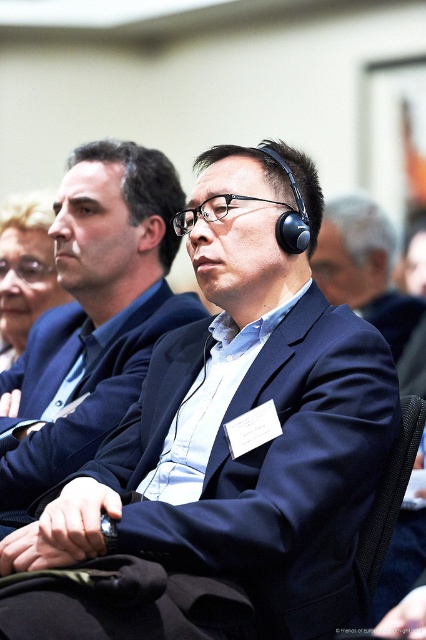
Which of these two, matte black headphones at center or black fabric chair at lower right, stands taller?

matte black headphones at center

This screenshot has height=640, width=426. Find the location of `matte black headphones at center`. matte black headphones at center is located at coordinates (363, 268).

Does matte black suit at center have a lesser height compared to matte black headphones at center?

No, matte black suit at center is not shorter than matte black headphones at center.

Between matte black suit at center and matte black headphones at center, which one is positioned higher?

matte black headphones at center is higher up.

Does point (169, 305) lie behind point (350, 291)?

No, it is in front of (350, 291).

Image resolution: width=426 pixels, height=640 pixels. Find the location of `matte black suit at center`. matte black suit at center is located at coordinates (94, 316).

Between matte black headphones at center and matte black suit at left, which one is positioned lower?

matte black suit at left is lower down.

Does matte black headphones at center have a greater height compared to matte black suit at left?

Indeed, matte black headphones at center has a greater height compared to matte black suit at left.

This screenshot has width=426, height=640. What do you see at coordinates (363, 268) in the screenshot?
I see `matte black headphones at center` at bounding box center [363, 268].

Locate an element on the screen. The height and width of the screenshot is (640, 426). matte black headphones at center is located at coordinates (363, 268).